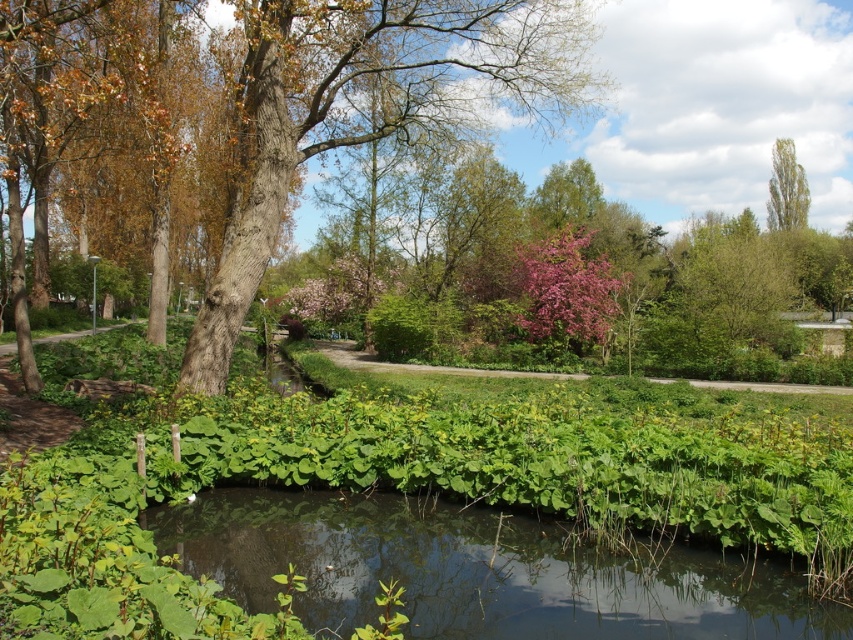
You are a gardener planning to plant a new flower bed between the green leafy water at center and the smooth brown tree trunk at center. Which object should you place the flowers closer to to ensure they receive more sunlight?

The green leafy water at center is in front of the smooth brown tree trunk at center, so planting the flowers closer to the green leafy water at center would place them further away from the tree trunk, allowing them to receive more sunlight.

You are planning to plant a new tree in your backyard. You want to know which tree from the image would cast a larger shadow in the afternoon. Based on the smooth brown tree trunk at center and the green leafy tree at upper right, which one would cast a larger shadow?

The smooth brown tree trunk at center has a greater height compared to the green leafy tree at upper right, so it would cast a larger shadow in the afternoon.